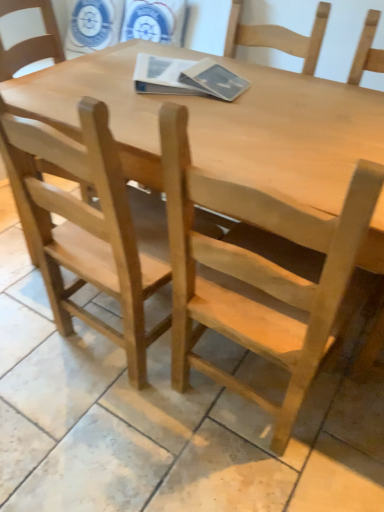
Locate an element on the screen. This screenshot has width=384, height=512. vacant space to the right of natural wood chair at center, placed as the first chair when sorted from right to left is located at coordinates (343, 421).